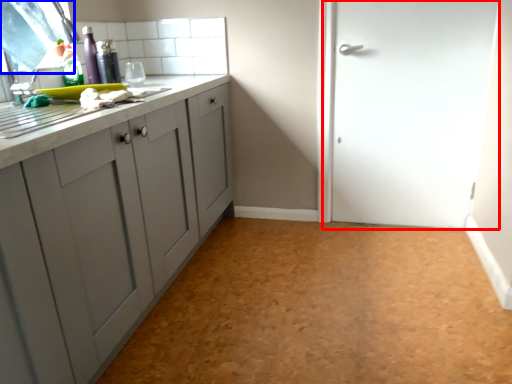
Question: Which point is further to the camera, door (highlighted by a red box) or window screen (highlighted by a blue box)?

Choices:
 (A) door
 (B) window screen

Answer: (A)